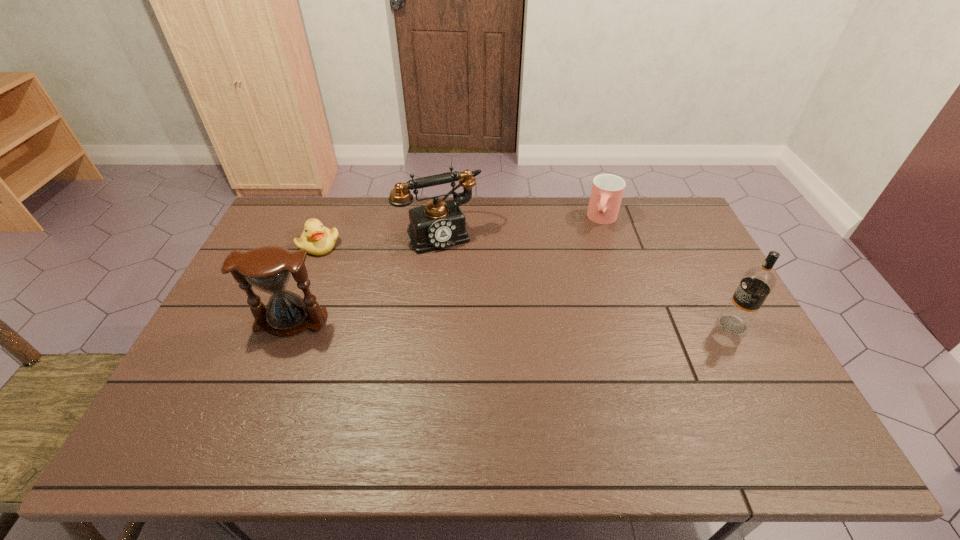
The image size is (960, 540). What are the coordinates of `vacant position at the near left corner of the desktop` in the screenshot? It's located at (228, 404).

The height and width of the screenshot is (540, 960). I want to click on unoccupied area between the hourglass and the second object from right to left, so click(x=447, y=271).

Find the location of `free spot between the hourglass and the fourth object from left to right`. free spot between the hourglass and the fourth object from left to right is located at coordinates (447, 271).

Where is `vacant point located between the hourglass and the rightmost object`? Image resolution: width=960 pixels, height=540 pixels. vacant point located between the hourglass and the rightmost object is located at coordinates (512, 323).

Where is `free spot between the third object from right to left and the vodka`? The image size is (960, 540). free spot between the third object from right to left and the vodka is located at coordinates (587, 279).

You are a GUI agent. You are given a task and a screenshot of the screen. Output one action in this format:
    pyautogui.click(x=<x>, y=<y>)
    Task: Click on the free space between the shortest object and the third object from left to right
    The width and height of the screenshot is (960, 540).
    Given the screenshot: What is the action you would take?
    pyautogui.click(x=379, y=239)

In order to click on vacant region between the hourglass and the cup in this screenshot , I will do `click(447, 271)`.

Locate an element on the screen. This screenshot has height=540, width=960. free space between the hourglass and the rightmost object is located at coordinates (512, 323).

The height and width of the screenshot is (540, 960). Identify the location of free space that is in between the telephone and the cup. (521, 226).

Identify which object is the closest to the hourglass. Please provide its 2D coordinates. Your answer should be formatted as a tuple, i.e. [(x, y)], where the tuple contains the x and y coordinates of a point satisfying the conditions above.

[(316, 239)]